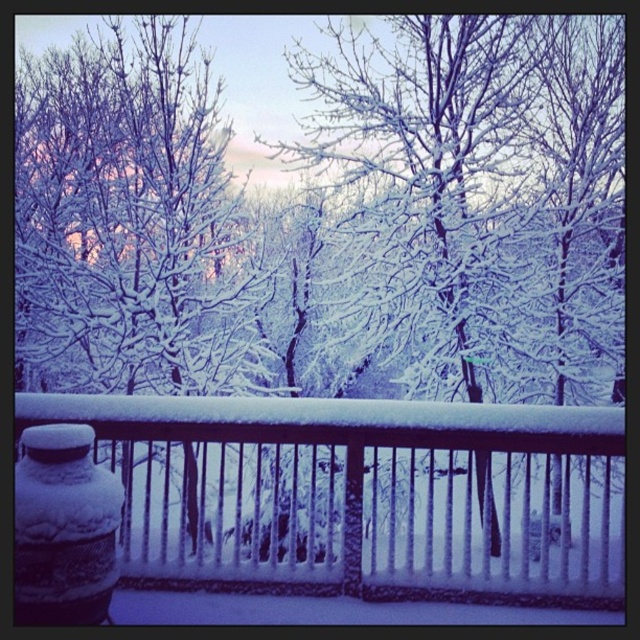
Question: Which of the following is the farthest from the observer?

Choices:
 (A) (488, 209)
 (B) (445, 580)

Answer: (A)

Question: Does snow-covered wooden railing at lower center have a lesser width compared to white frosty tree at center?

Choices:
 (A) no
 (B) yes

Answer: (B)

Question: Among these objects, which one is nearest to the camera?

Choices:
 (A) white frosty tree at center
 (B) snow-covered wooden railing at lower center

Answer: (A)

Question: Is snow-covered wooden railing at lower center to the left of white frosty tree at center from the viewer's perspective?

Choices:
 (A) no
 (B) yes

Answer: (A)

Question: Does snow-covered wooden railing at lower center have a lesser width compared to white frosty tree at center?

Choices:
 (A) no
 (B) yes

Answer: (B)